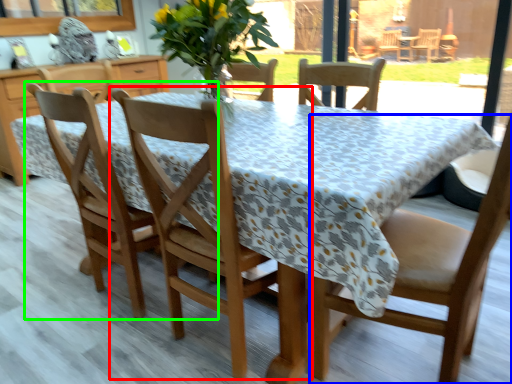
Question: Which is farther away from chair (highlighted by a red box)? chair (highlighted by a blue box) or chair (highlighted by a green box)?

Choices:
 (A) chair
 (B) chair

Answer: (A)